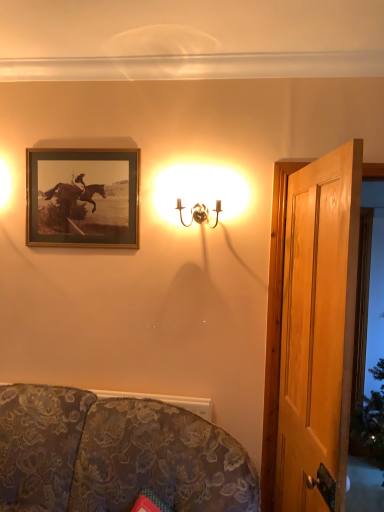
The height and width of the screenshot is (512, 384). Identify the location of transparent glass door at right. (370, 371).

Measure the distance between gold-framed print at upper left and camera.

gold-framed print at upper left and camera are 7.52 feet apart from each other.

Where is `gold-framed print at upper left`? The height and width of the screenshot is (512, 384). gold-framed print at upper left is located at coordinates (83, 197).

In order to face wooden door at right, should I rotate leftwards or rightwards?

You should look right and rotate roughly 19.285 degrees.

The image size is (384, 512). I want to click on transparent glass door at right, so click(370, 371).

Would you say gold-framed print at upper left is to the left or to the right of wooden door at right in the picture?

Based on their positions, gold-framed print at upper left is located to the left of wooden door at right.

Between gold-framed print at upper left and wooden door at right, which one has less height?

gold-framed print at upper left.

Can you confirm if gold-framed print at upper left is smaller than wooden door at right?

Correct, gold-framed print at upper left occupies less space than wooden door at right.

Is gold-framed print at upper left situated inside wooden door at right or outside?

The correct answer is: outside.

Where is `door that is behind the gold metallic wall sconce at upper center`? Image resolution: width=384 pixels, height=512 pixels. door that is behind the gold metallic wall sconce at upper center is located at coordinates (310, 327).

Relative to gold metallic wall sconce at upper center, is wooden door at right in front or behind?

wooden door at right is behind gold metallic wall sconce at upper center.

Is wooden door at right smaller than gold metallic wall sconce at upper center?

No, wooden door at right is not smaller than gold metallic wall sconce at upper center.

In the image, is gold-framed print at upper left positioned in front of or behind transparent glass door at right?

Visually, gold-framed print at upper left is located in front of transparent glass door at right.

From the image's perspective, does gold-framed print at upper left appear higher than transparent glass door at right?

Yes.

From the picture: Looking at the image, does gold-framed print at upper left seem bigger or smaller compared to transparent glass door at right?

Considering their sizes, gold-framed print at upper left takes up less space than transparent glass door at right.

Considering the sizes of objects wooden door at right and transparent glass door at right in the image provided, who is thinner, wooden door at right or transparent glass door at right?

wooden door at right.

Could you tell me if wooden door at right is turned towards transparent glass door at right?

No.

Can you confirm if wooden door at right is bigger than transparent glass door at right?

Incorrect, wooden door at right is not larger than transparent glass door at right.

Is wooden door at right placed right next to transparent glass door at right?

No.

Measure the distance from wooden door at right to floral fabric couch at lower left.

They are 29.90 inches apart.

Can you confirm if wooden door at right is wider than floral fabric couch at lower left?

No.

Does wooden door at right touch floral fabric couch at lower left?

wooden door at right is not next to floral fabric couch at lower left, and they're not touching.

Considering the sizes of objects wooden door at right and floral fabric couch at lower left in the image provided, who is smaller, wooden door at right or floral fabric couch at lower left?

With smaller size is wooden door at right.

Can you confirm if transparent glass door at right is thinner than wooden door at right?

In fact, transparent glass door at right might be wider than wooden door at right.

Is transparent glass door at right oriented away from wooden door at right?

No, transparent glass door at right is not facing away from wooden door at right.

Is the surface of transparent glass door at right in direct contact with wooden door at right?

There is a gap between transparent glass door at right and wooden door at right.

From a real-world perspective, does transparent glass door at right stand above wooden door at right?

No, from a real-world perspective, transparent glass door at right is not above wooden door at right.

Is wooden door at right thinner than gold-framed print at upper left?

In fact, wooden door at right might be wider than gold-framed print at upper left.

From a real-world perspective, between wooden door at right and gold-framed print at upper left, who is vertically higher?

In real-world perspective, gold-framed print at upper left is above.

Identify the location of door in front of the gold-framed print at upper left. The image size is (384, 512). (310, 327).

This screenshot has height=512, width=384. Identify the location of door that is under the gold metallic wall sconce at upper center (from a real-world perspective). (310, 327).

Which object lies further to the anchor point gold-framed print at upper left, wooden door at right or transparent glass door at right?

transparent glass door at right is positioned further to the anchor gold-framed print at upper left.

Which object lies further to the anchor point wooden door at right, floral fabric couch at lower left or gold metallic wall sconce at upper center?

floral fabric couch at lower left is further to wooden door at right.

Based on their spatial positions, is gold metallic wall sconce at upper center or wooden door at right further from gold-framed print at upper left?

Based on the image, wooden door at right appears to be further to gold-framed print at upper left.

Based on their spatial positions, is floral fabric couch at lower left or wooden door at right closer to transparent glass door at right?

The object closer to transparent glass door at right is wooden door at right.

Which object lies further to the anchor point gold metallic wall sconce at upper center, transparent glass door at right or floral fabric couch at lower left?

floral fabric couch at lower left.

From the image, which object appears to be nearer to transparent glass door at right, gold metallic wall sconce at upper center or floral fabric couch at lower left?

gold metallic wall sconce at upper center.

From the image, which object appears to be farther from floral fabric couch at lower left, wooden door at right or gold-framed print at upper left?

gold-framed print at upper left.

When comparing their distances from gold metallic wall sconce at upper center, does transparent glass door at right or wooden door at right seem further?

transparent glass door at right is positioned further to the anchor gold metallic wall sconce at upper center.

Identify the location of studio couch between gold-framed print at upper left and transparent glass door at right in the horizontal direction. This screenshot has height=512, width=384. (115, 455).

You are a GUI agent. You are given a task and a screenshot of the screen. Output one action in this format:
    pyautogui.click(x=<x>, y=<y>)
    Task: Click on the door located between gold-framed print at upper left and transparent glass door at right in the left-right direction
    Image resolution: width=384 pixels, height=512 pixels.
    Given the screenshot: What is the action you would take?
    pyautogui.click(x=310, y=327)

Identify the location of lamp between gold-framed print at upper left and transparent glass door at right from left to right. This screenshot has height=512, width=384. (200, 194).

Find the location of a particular element. This screenshot has height=512, width=384. door situated between floral fabric couch at lower left and transparent glass door at right from left to right is located at coordinates (310, 327).